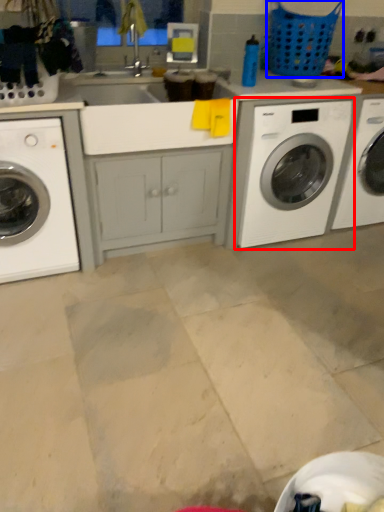
Question: Which point is closer to the camera, washing machine (highlighted by a red box) or basket (highlighted by a blue box)?

Choices:
 (A) washing machine
 (B) basket

Answer: (A)